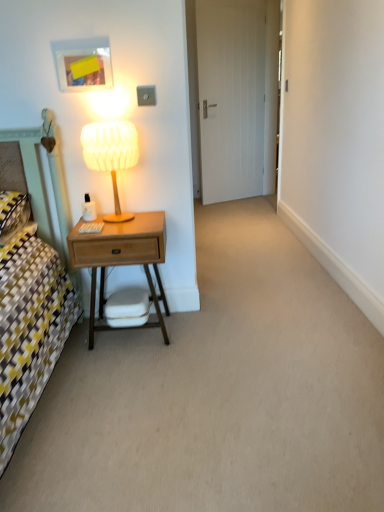
Locate an element on the screen. This screenshot has height=512, width=384. vacant space underneath white matte door at center (from a real-world perspective) is located at coordinates coord(241,196).